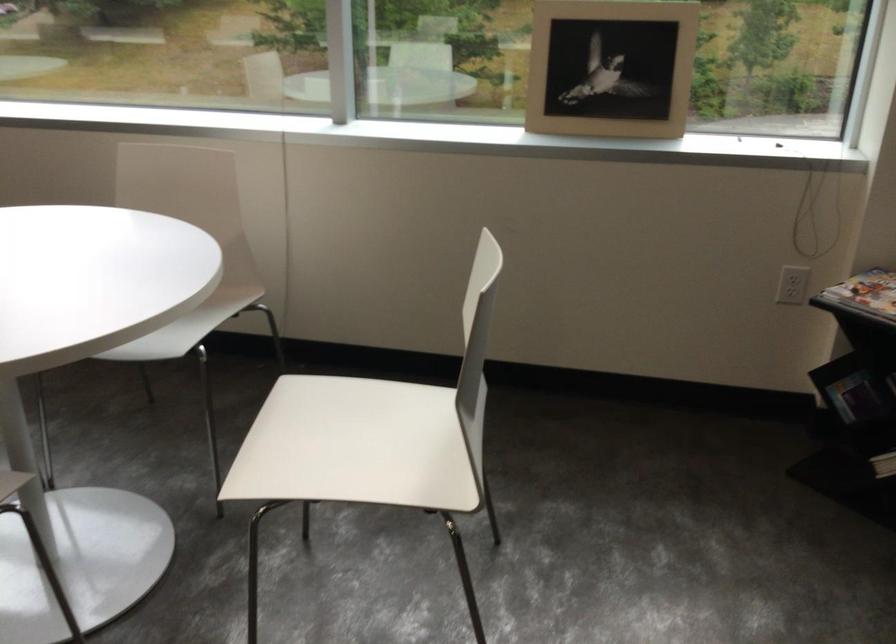
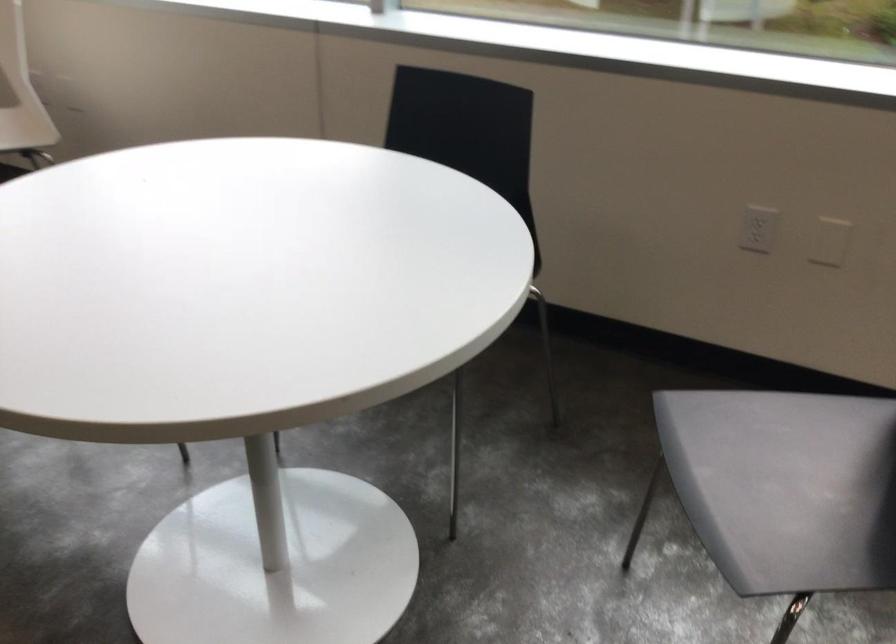
Question: In a continuous first-person perspective shot, in which direction is the camera moving?

Choices:
 (A) Left
 (B) Right
 (C) Forward
 (D) Backward

Answer: (A)